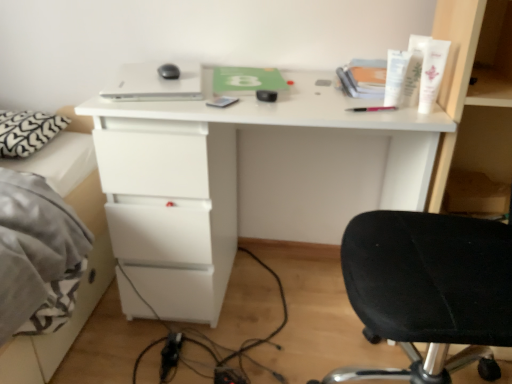
This screenshot has height=384, width=512. I want to click on free space between matte gray notepad at center and white plastic tube at upper right, the second toiletry when ordered from left to right, so click(x=302, y=104).